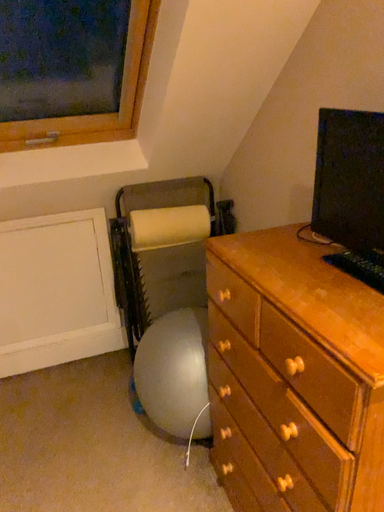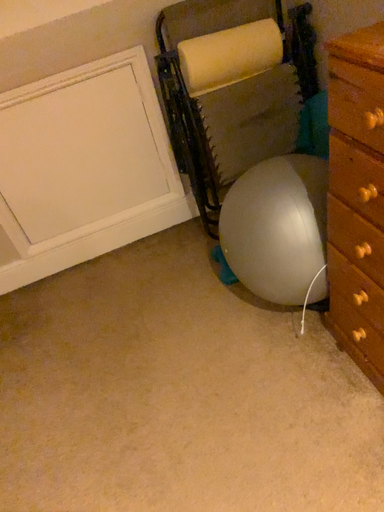
Question: Which way did the camera rotate in the video?

Choices:
 (A) rotated downward
 (B) rotated upward

Answer: (A)